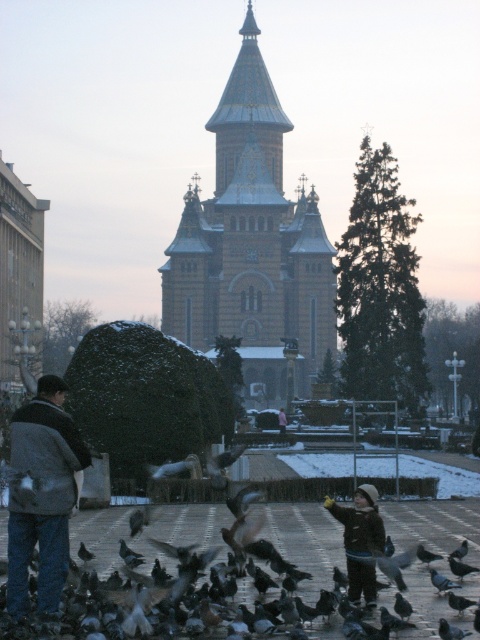
Question: Can you confirm if golden stone tower at center is smaller than gray feathered pigeon at center?

Choices:
 (A) yes
 (B) no

Answer: (B)

Question: Which of the following is the farthest from the observer?

Choices:
 (A) [x=41, y=417]
 (B) [x=144, y=518]
 (C) [x=277, y=419]

Answer: (C)

Question: Considering the real-world distances, which object is farthest from the dark brown winter coat at lower center?

Choices:
 (A) gray matte pigeon at center
 (B) gray feathered pigeon at center
 (C) golden stone tower at center

Answer: (C)

Question: Is dark gray jacket at lower left above dark brown winter coat at lower center?

Choices:
 (A) no
 (B) yes

Answer: (B)

Question: Which of these objects is positioned closest to the dark brown winter coat at lower center?

Choices:
 (A) pink fabric jacket at center
 (B) golden stone tower at center
 (C) gray matte pigeon at center
 (D) gray feathered pigeon at center

Answer: (D)

Question: Does golden stone tower at center appear on the left side of pink fabric jacket at center?

Choices:
 (A) no
 (B) yes

Answer: (B)